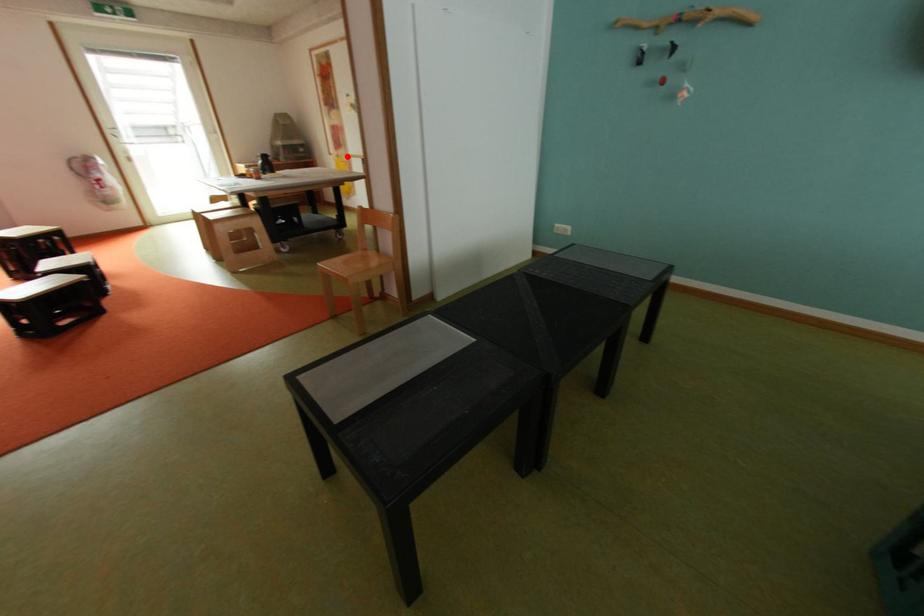
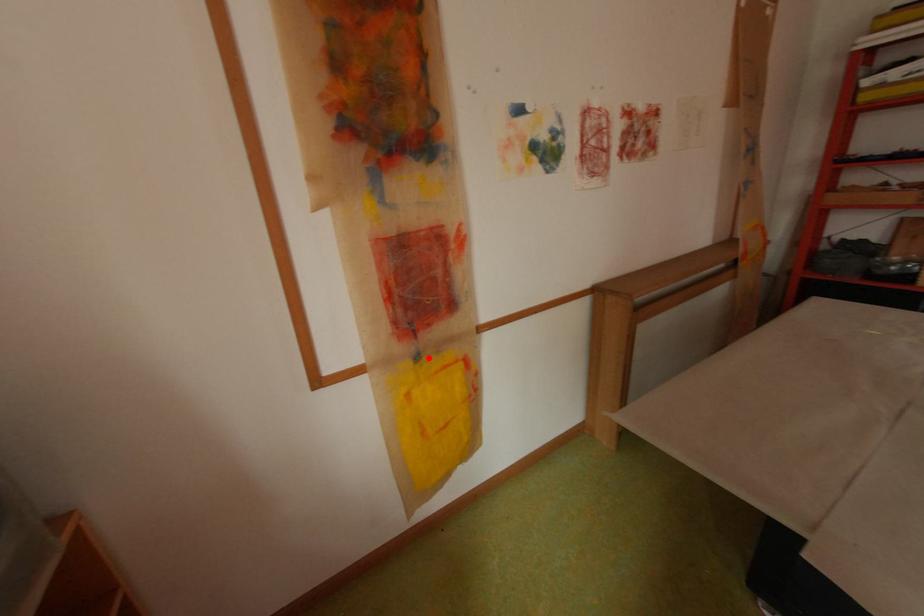
I am providing you with two images of the same scene from different viewpoints. A red point is marked on the first image and another point is marked on the second image. Are the points marked in image1 and image2 representing the same 3D position?

Yes